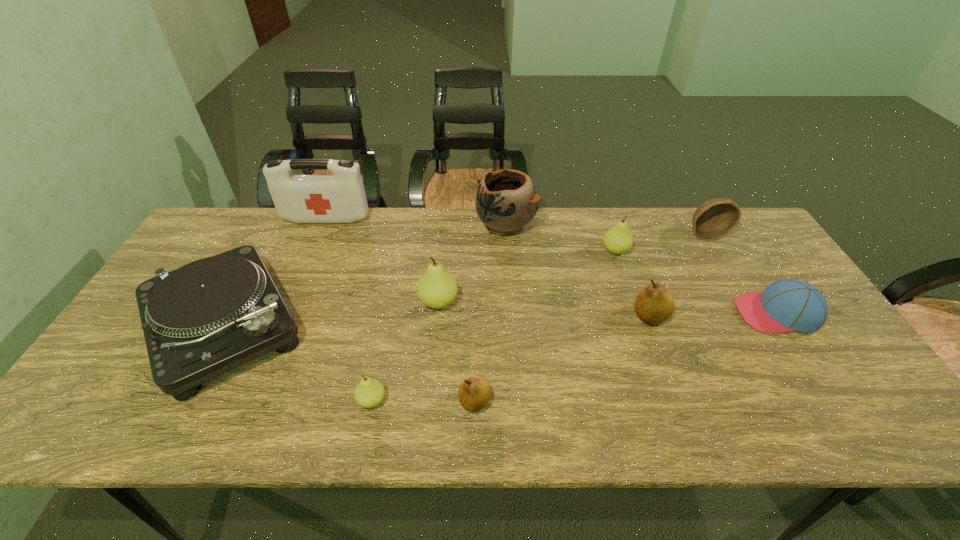
Identify the location of bowl present at the far edge. (713, 219).

Where is `pear present at the far edge`? Image resolution: width=960 pixels, height=540 pixels. pear present at the far edge is located at coordinates pyautogui.click(x=618, y=239).

This screenshot has height=540, width=960. What are the coordinates of `record player located at the near edge` in the screenshot? It's located at (210, 316).

The height and width of the screenshot is (540, 960). I want to click on object located in the left edge section of the desktop, so click(x=210, y=316).

This screenshot has width=960, height=540. What are the coordinates of `bowl located at the right edge` in the screenshot? It's located at (713, 219).

Identify the location of baseball cap present at the right edge. The height and width of the screenshot is (540, 960). (787, 305).

The height and width of the screenshot is (540, 960). What are the coordinates of `object situated at the near left corner` in the screenshot? It's located at (210, 316).

Locate an element on the screen. object that is at the far right corner is located at coordinates (713, 219).

Where is `vacant space at the far edge of the desktop`? vacant space at the far edge of the desktop is located at coordinates (295, 239).

This screenshot has width=960, height=540. I want to click on free location at the near edge of the desktop, so click(465, 434).